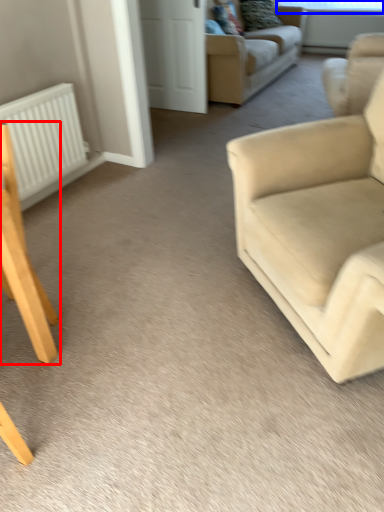
Question: Which object is closer to the camera taking this photo, chair (highlighted by a red box) or window screen (highlighted by a blue box)?

Choices:
 (A) chair
 (B) window screen

Answer: (A)